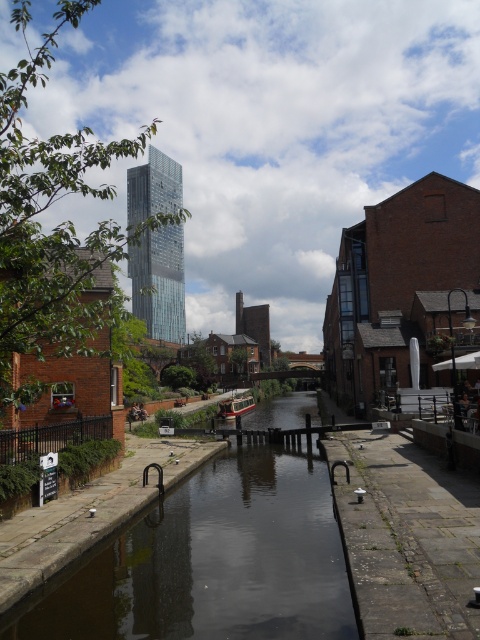
Based on the photo, you are a tourist standing on the walkway along the canal. You see the dark reflective water at center and the wooden boat at center. Which object is closer to the right side of the canal?

The dark reflective water at center is closer to the right side of the canal because it is positioned to the right of the wooden boat at center.

You are a tourist standing on the walkway next to the canal. You see the dark reflective water at center and the wooden boat at center. Which object is closer to the sky?

The dark reflective water at center is located above the wooden boat at center, so the dark reflective water at center is closer to the sky.